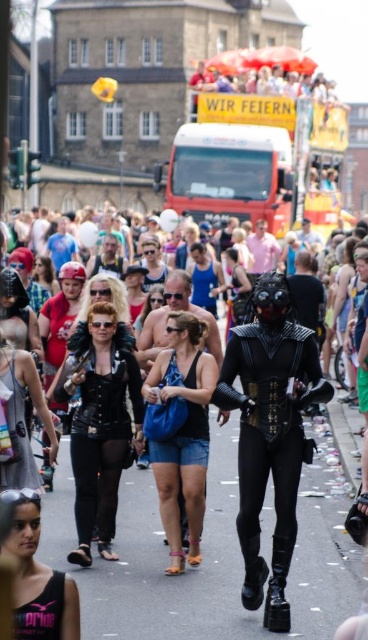
Question: Can you confirm if leather jacket at center is wider than matte black tank top at center?

Choices:
 (A) no
 (B) yes

Answer: (B)

Question: In this image, where is white glossy truck at center located relative to blue denim shorts at center?

Choices:
 (A) right
 (B) left

Answer: (A)

Question: Among these points, which one is farthest from the camera?

Choices:
 (A) (270, 328)
 (B) (18, 365)
 (C) (184, 460)

Answer: (B)

Question: Does leather jacket at center appear on the right side of white glossy truck at center?

Choices:
 (A) no
 (B) yes

Answer: (A)

Question: Among these objects, which one is farthest from the camera?

Choices:
 (A) matte black costume at center
 (B) leather jacket at center

Answer: (B)

Question: Which point is farther from the camera taking this photo?

Choices:
 (A) (178, 572)
 (B) (250, 529)
 (C) (26, 545)

Answer: (A)